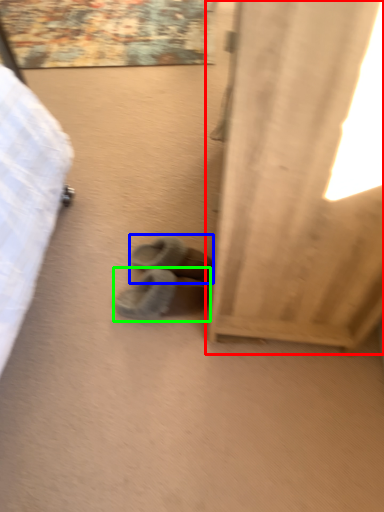
Question: Considering the real-world distances, which object is closest to curtain (highlighted by a red box)? footwear (highlighted by a blue box) or footwear (highlighted by a green box).

Choices:
 (A) footwear
 (B) footwear

Answer: (B)